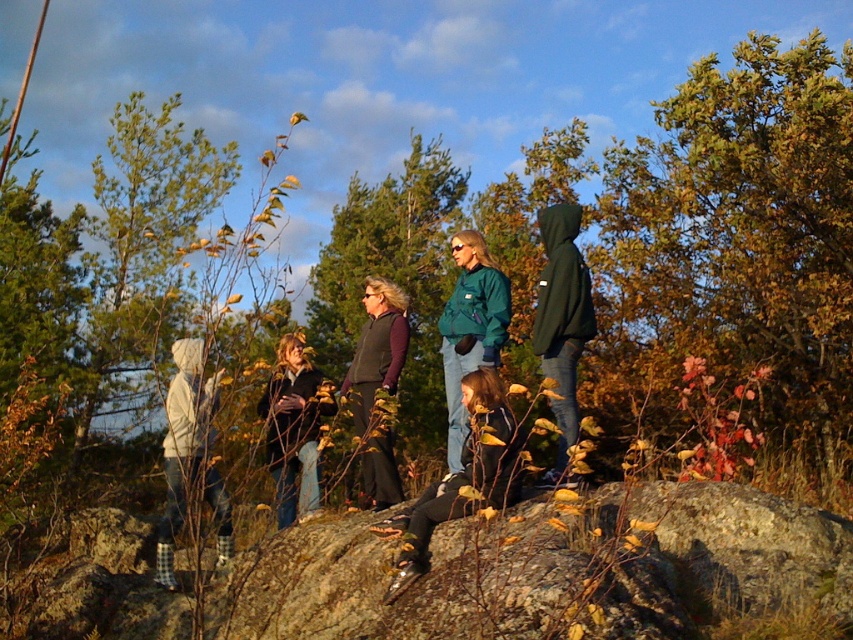
Question: Estimate the real-world distances between objects in this image. Which object is farther from the velvet purple vest at center?

Choices:
 (A) dark green hoodie at center
 (B) dark blue jeans at center
 (C) matte green jacket at center
 (D) brown mossy rock at center

Answer: (D)

Question: Can you confirm if green matte jacket at center is positioned below dark green hoodie at center?

Choices:
 (A) no
 (B) yes

Answer: (B)

Question: Which of these objects is positioned closest to the brown mossy rock at center?

Choices:
 (A) matte green jacket at center
 (B) dark green hoodie at center
 (C) green matte jacket at center
 (D) velvet purple vest at center

Answer: (D)

Question: Which object is positioned farthest from the matte black jacket at center?

Choices:
 (A) green matte jacket at center
 (B) dark green hoodie at center

Answer: (B)

Question: Can you confirm if brown mossy rock at center is thinner than dark blue jeans at center?

Choices:
 (A) no
 (B) yes

Answer: (A)

Question: Can you confirm if dark blue jeans at center is smaller than matte black jacket at center?

Choices:
 (A) yes
 (B) no

Answer: (B)